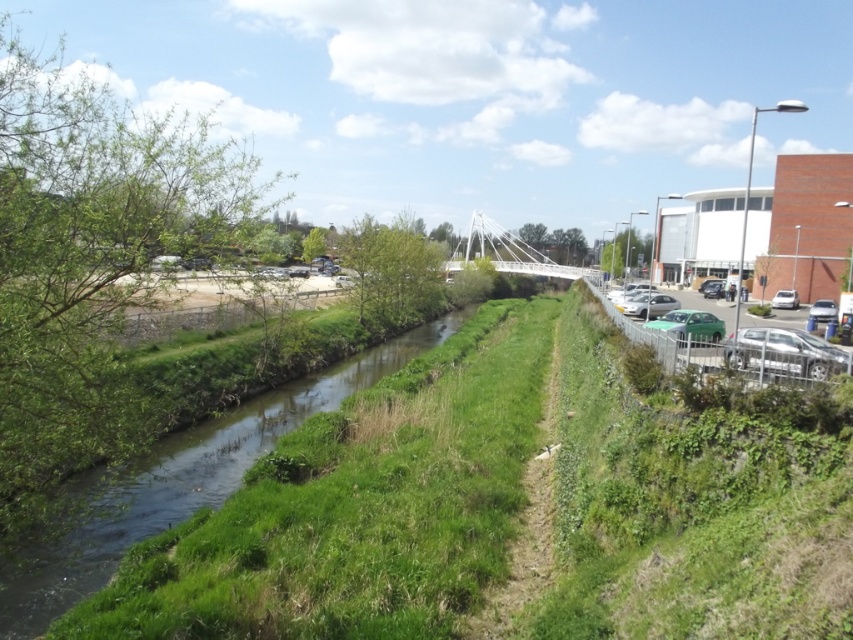
You are a delivery person trying to park your 1.8 meters wide van in the parking lot. You see two cars labeled as silver metallic car at right and metallic silver car at right. Which car has a wider body that might block your parking spot?

The silver metallic car at right has a wider body than the metallic silver car at right, so it might block your parking spot more than the other.

You are standing at the center of the pedestrian bridge and want to locate the silver metallic car at right. According to the coordinates provided, in which direction should you look relative to the bridge?

The silver metallic car at right is located at coordinates point (784, 353). Since you are standing at the center of the pedestrian bridge, you should look to the right side to locate the silver metallic car at right.

From the picture: You are a delivery drone flying over the urban landscape. You need to deliver a package to the parking lot but must avoid flying over the green grassy stream at center. Can you safely fly over the white glossy sedan at right instead?

The green grassy stream at center is taller than the white glossy sedan at right. Since the drone needs to avoid the stream, it can safely fly over the white glossy sedan at right as it is shorter in height.